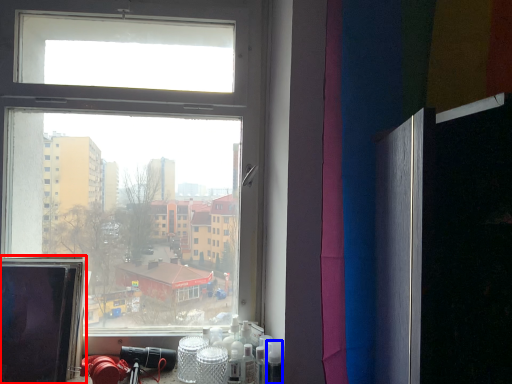
Question: Among these objects, which one is farthest to the camera, computer screen (highlighted by a red box) or toiletry (highlighted by a blue box)?

Choices:
 (A) computer screen
 (B) toiletry

Answer: (B)